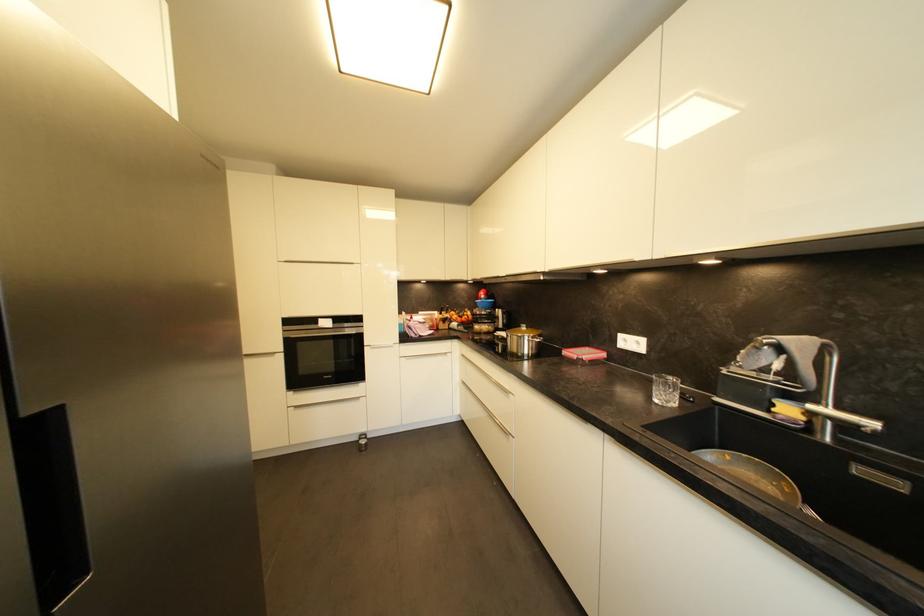
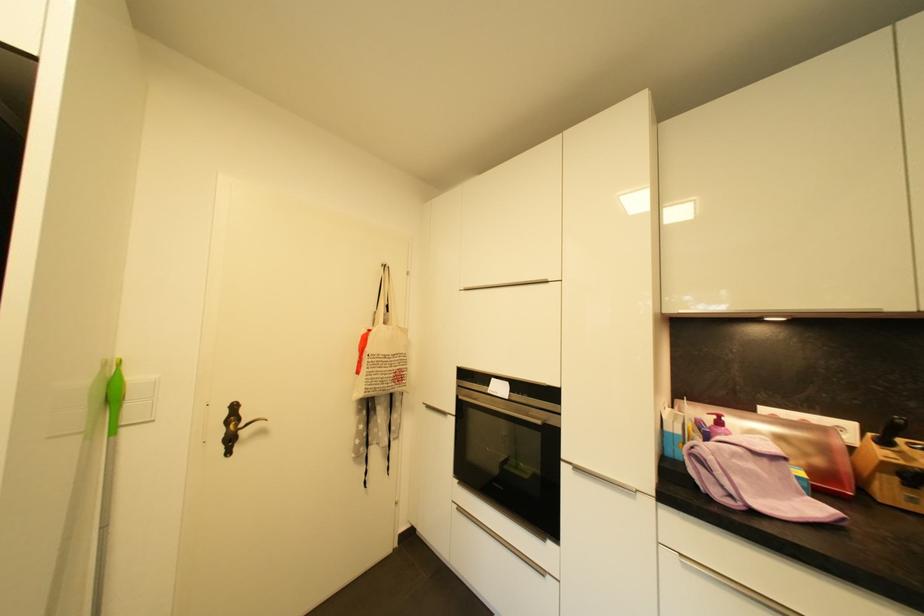
Where in the second image is the point corresponding to (x=417, y=320) from the first image?

(724, 424)